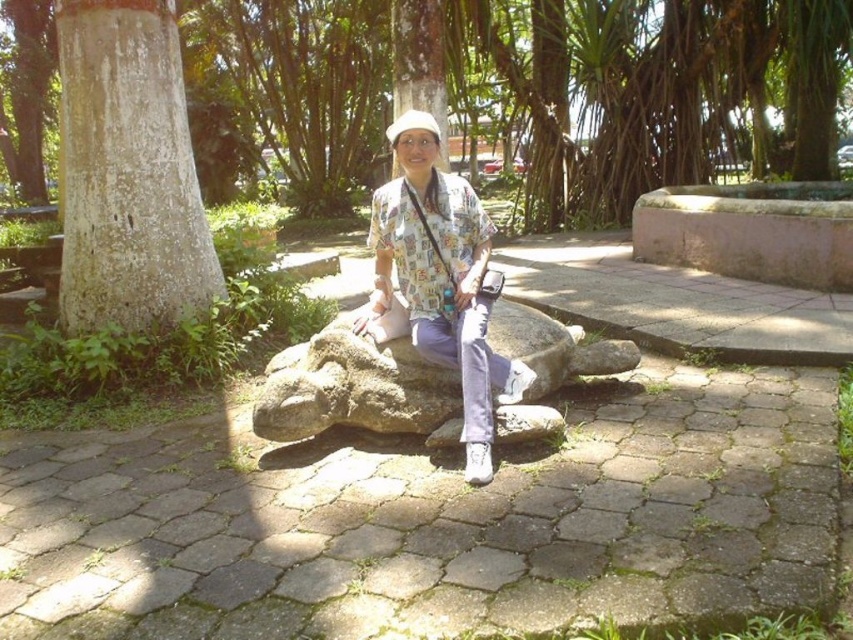
You are a photographer standing on the cobblestone path in the park. You want to take a photo of the white rough textured tree trunk at left and the matte floral shirt at center. Which object should you focus on first if you want to capture both in the same frame without moving your camera?

The white rough textured tree trunk at left is positioned over the matte floral shirt at center, so you should focus on the matte floral shirt at center first to ensure both are in focus.